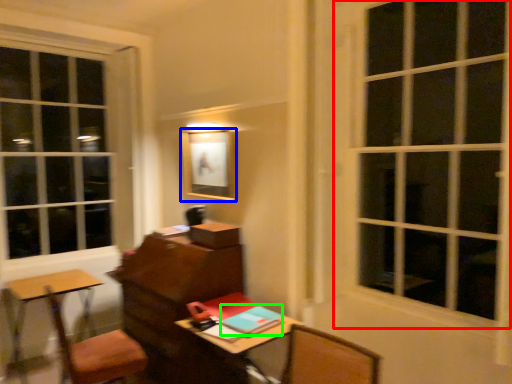
Question: Which object is the closest to the window (highlighted by a red box)? Choose among these: picture frame (highlighted by a blue box) or notebook (highlighted by a green box).

Choices:
 (A) picture frame
 (B) notebook

Answer: (A)